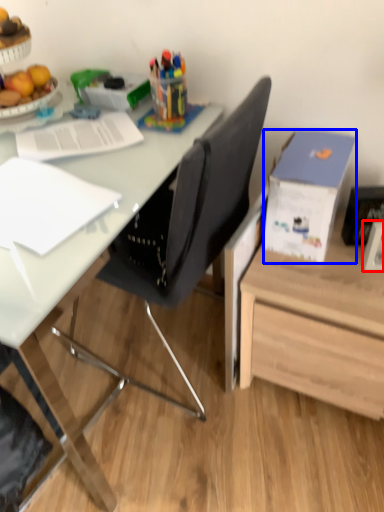
Question: Which object is closer to the camera taking this photo, picture frame (highlighted by a red box) or box (highlighted by a blue box)?

Choices:
 (A) picture frame
 (B) box

Answer: (B)